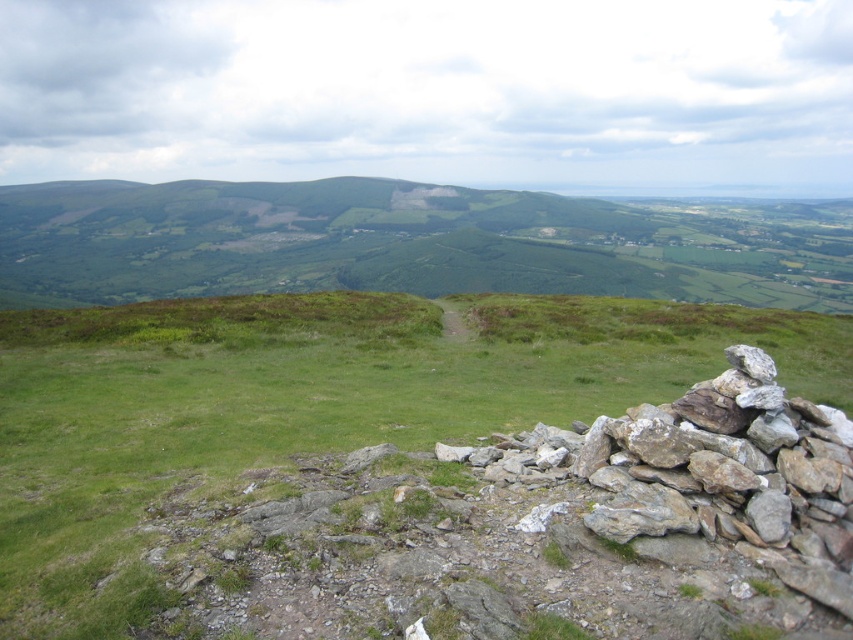
Question: Does green grassy at center appear over green grassy hillside at center?

Choices:
 (A) no
 (B) yes

Answer: (A)

Question: Which object appears farthest from the camera in this image?

Choices:
 (A) green grassy at center
 (B) green grassy hillside at center

Answer: (B)

Question: Is green grassy at center behind green grassy hillside at center?

Choices:
 (A) no
 (B) yes

Answer: (A)

Question: Does green grassy at center have a smaller size compared to green grassy hillside at center?

Choices:
 (A) no
 (B) yes

Answer: (B)